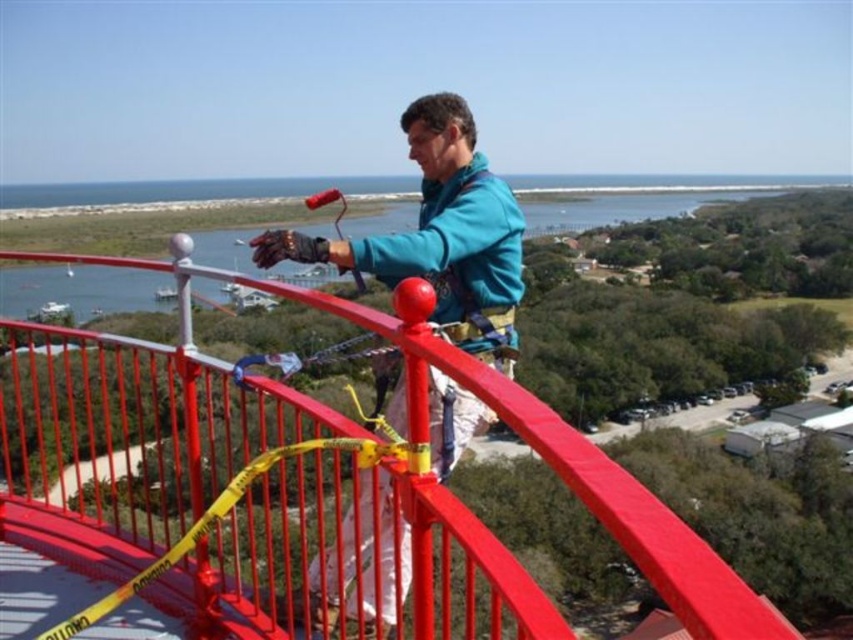
Does smooth metal railing at center have a larger size compared to teal fabric jacket at center?

Yes, smooth metal railing at center is bigger than teal fabric jacket at center.

Can you confirm if smooth metal railing at center is positioned to the right of teal fabric jacket at center?

Incorrect, smooth metal railing at center is not on the right side of teal fabric jacket at center.

Is point (338, 490) closer to viewer compared to point (502, 289)?

Yes, point (338, 490) is closer to viewer.

Locate an element on the screen. smooth metal railing at center is located at coordinates (305, 484).